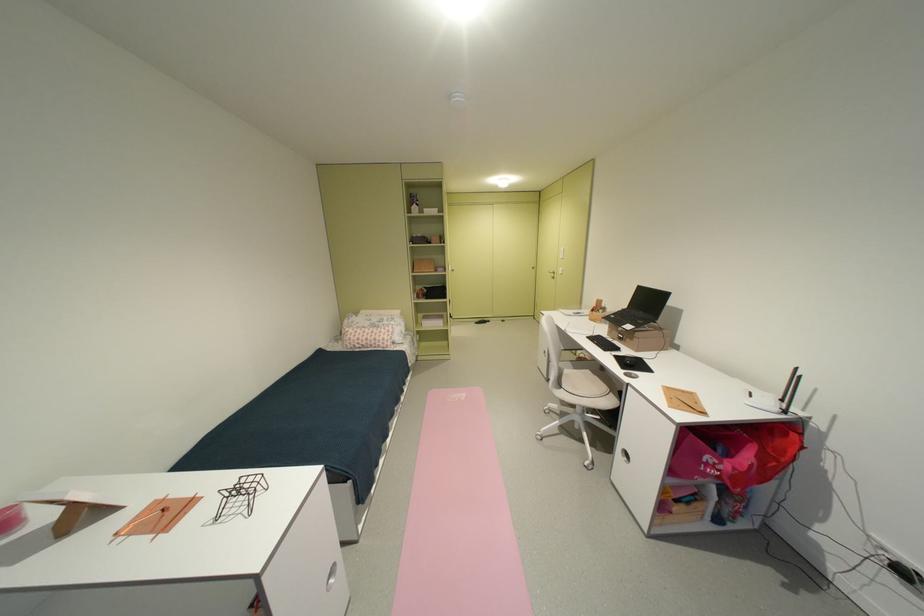
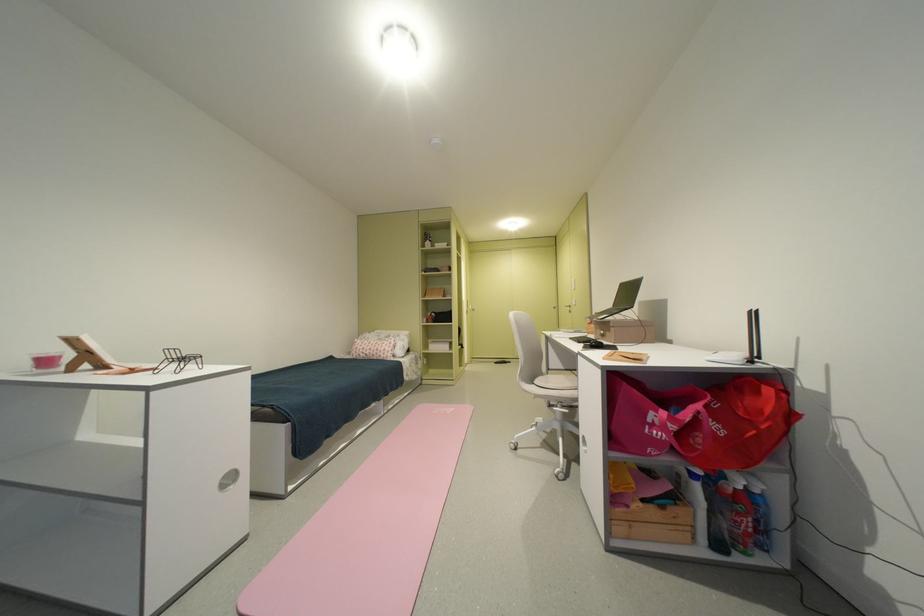
Find the pixel in the second image that matches point 748,504 in the first image.

(755, 519)